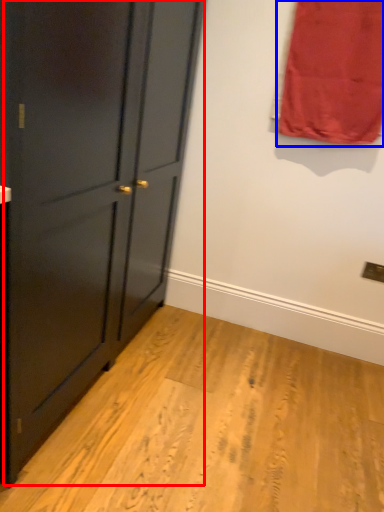
Question: Which of the following is the farthest to the observer, door (highlighted by a red box) or curtain (highlighted by a blue box)?

Choices:
 (A) door
 (B) curtain

Answer: (B)